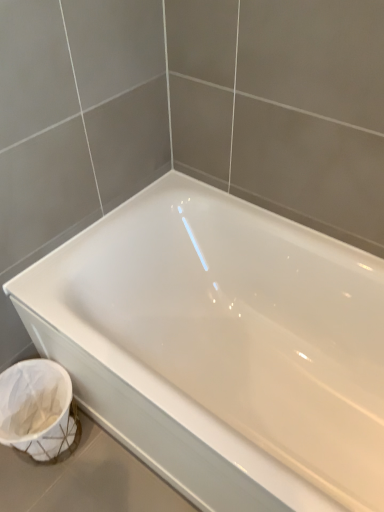
Question: Is white glossy bathtub at center to the left or to the right of white woven laundry basket at lower left in the image?

Choices:
 (A) right
 (B) left

Answer: (A)

Question: Is white glossy bathtub at center in front of or behind white woven laundry basket at lower left in the image?

Choices:
 (A) behind
 (B) front

Answer: (B)

Question: From the image's perspective, is white glossy bathtub at center above or below white woven laundry basket at lower left?

Choices:
 (A) below
 (B) above

Answer: (B)

Question: Is white woven laundry basket at lower left wider or thinner than white glossy bathtub at center?

Choices:
 (A) wide
 (B) thin

Answer: (B)

Question: Considering the positions of point (29, 385) and point (261, 462), is point (29, 385) closer or farther from the camera than point (261, 462)?

Choices:
 (A) closer
 (B) farther

Answer: (B)

Question: In the image, is white woven laundry basket at lower left positioned in front of or behind white glossy bathtub at center?

Choices:
 (A) front
 (B) behind

Answer: (B)

Question: From their relative heights in the image, would you say white woven laundry basket at lower left is taller or shorter than white glossy bathtub at center?

Choices:
 (A) tall
 (B) short

Answer: (B)